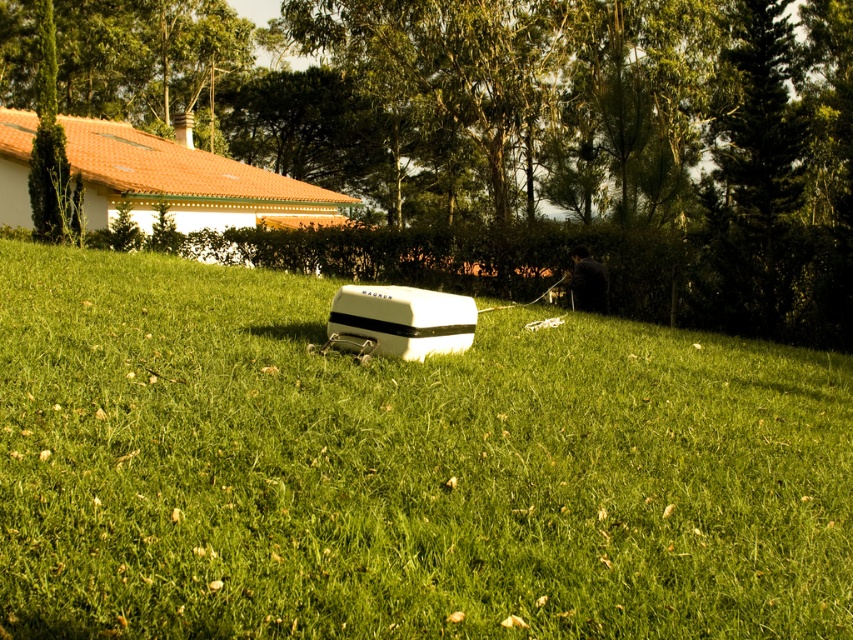
You are standing at the position of the person in the scene. Looking towards the direction they are facing, which of the two points, point (90, 550) or point (194, 70), is closer to you?

Point (90, 550) is in front of point (194, 70), so it is closer to you.

You are standing on the green grassy at center and want to look up at the green leafy tree at center. In which direction should you look?

You should look upward because the green grassy at center is located below the green leafy tree at center.

Looking at the scene, which object takes up more space in the image between the green grassy at center and the green leafy tree at center?

The green leafy tree at center takes up more space in the image than the green grassy at center, as the grassy area is described as having a smaller size compared to the tree.